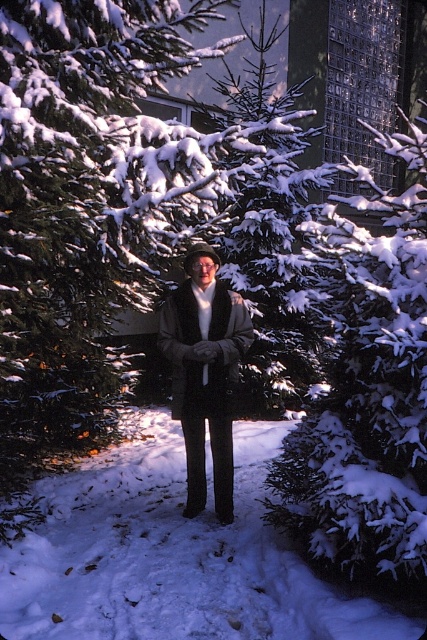
You are standing at the point marked as point (366, 385) in the winter scene. Based on the description, what is the immediate surface beneath your feet?

The immediate surface beneath your feet at point (366, 385) is snow on a snow covered evergreen at center.